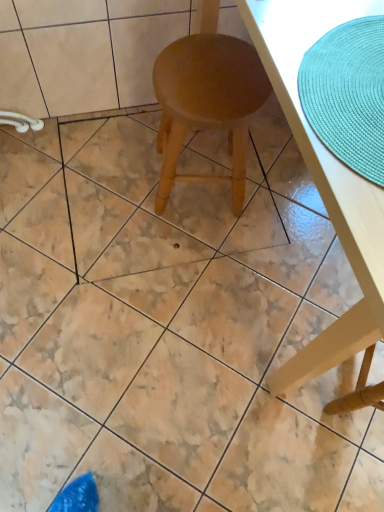
Question: Is wooden table at center turned away from teal woven placemat at upper right?

Choices:
 (A) yes
 (B) no

Answer: (B)

Question: Is the position of wooden table at center less distant than that of teal woven placemat at upper right?

Choices:
 (A) no
 (B) yes

Answer: (B)

Question: From the image's perspective, is wooden table at center below teal woven placemat at upper right?

Choices:
 (A) yes
 (B) no

Answer: (B)

Question: Considering the relative sizes of wooden table at center and teal woven placemat at upper right in the image provided, is wooden table at center thinner than teal woven placemat at upper right?

Choices:
 (A) no
 (B) yes

Answer: (A)

Question: Is wooden table at center to the left of teal woven placemat at upper right from the viewer's perspective?

Choices:
 (A) yes
 (B) no

Answer: (B)

Question: Is wooden table at center shorter than teal woven placemat at upper right?

Choices:
 (A) no
 (B) yes

Answer: (A)

Question: Is there a large distance between wooden table at center and light brown wood stool at center?

Choices:
 (A) yes
 (B) no

Answer: (B)

Question: Could you tell me if wooden table at center is facing light brown wood stool at center?

Choices:
 (A) no
 (B) yes

Answer: (A)

Question: Is wooden table at center wider than light brown wood stool at center?

Choices:
 (A) no
 (B) yes

Answer: (B)

Question: Is wooden table at center taller than light brown wood stool at center?

Choices:
 (A) no
 (B) yes

Answer: (B)

Question: From the image's perspective, would you say wooden table at center is positioned over light brown wood stool at center?

Choices:
 (A) no
 (B) yes

Answer: (A)

Question: Is wooden table at center outside light brown wood stool at center?

Choices:
 (A) yes
 (B) no

Answer: (A)

Question: Is light brown wood stool at center beside wooden table at center?

Choices:
 (A) yes
 (B) no

Answer: (B)